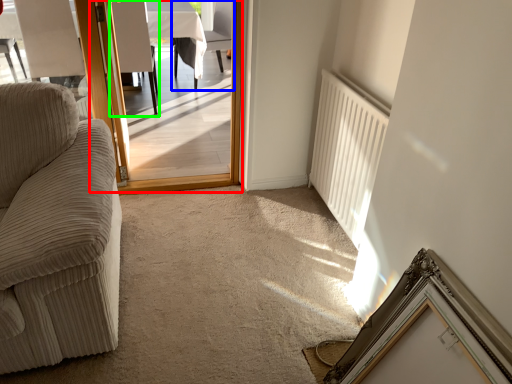
Question: Based on their relative distances, which object is nearer to screen door (highlighted by a red box)? Choose from chair (highlighted by a blue box) and armchair (highlighted by a green box).

Choices:
 (A) chair
 (B) armchair

Answer: (B)